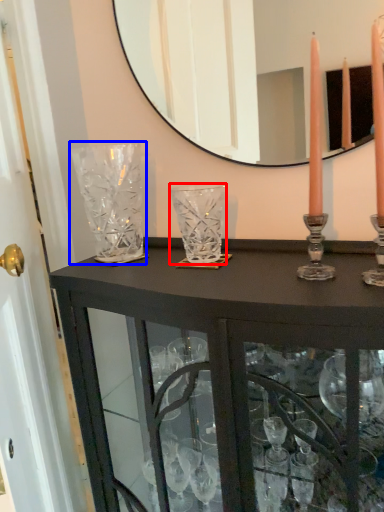
Question: Among these objects, which one is farthest to the camera, glass vase (highlighted by a red box) or glass vase (highlighted by a blue box)?

Choices:
 (A) glass vase
 (B) glass vase

Answer: (B)